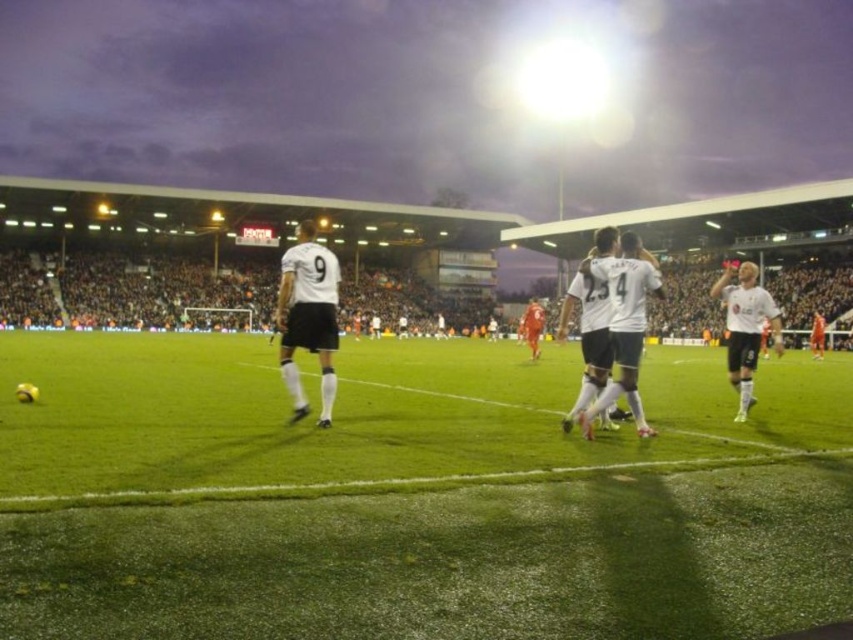
Question: Is white matte jersey at center wider than white jersey at center?

Choices:
 (A) yes
 (B) no

Answer: (A)

Question: Which point appears closest to the camera in this image?

Choices:
 (A) (756, 314)
 (B) (299, 276)

Answer: (B)

Question: Which point is farther to the camera?

Choices:
 (A) white matte jersey at right
 (B) white matte jersey at center
 (C) white jersey at center

Answer: (A)

Question: Can you confirm if white matte jersey at center is positioned below white jersey at center?

Choices:
 (A) no
 (B) yes

Answer: (B)

Question: Which object is positioned farthest from the white matte jersey at right?

Choices:
 (A) white jersey at center
 (B) white matte jersey at center

Answer: (B)

Question: Is white matte jersey at center smaller than white matte jersey at right?

Choices:
 (A) no
 (B) yes

Answer: (B)